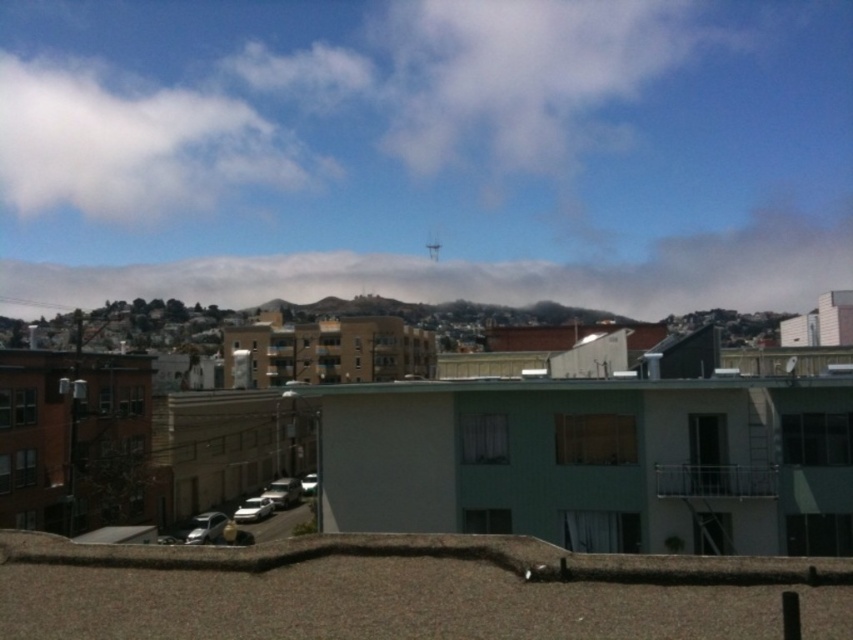
You are a drone operator who needs to fly a drone between the two clouds. The drone has a maximum flight distance of 200 feet. Can the drone safely fly between the white fluffy cloud at upper center and the white fluffy cloud at upper left without exceeding its range?

The distance between the white fluffy cloud at upper center and the white fluffy cloud at upper left is 214.18 feet, which exceeds the drone operator maximum flight distance of 200 feet. Therefore, the drone cannot safely fly between them without exceeding its range.

You are an architect designing a new rooftop garden on the textured rooftop with a low wall. You want to place a large sculpture between the white fluffy cloud at upper center and the white fluffy cloud at upper left. Which cloud should the sculpture be closer to if you want it to appear taller in the garden view?

The white fluffy cloud at upper left is taller than the white fluffy cloud at upper center. To make the sculpture appear taller, place it closer to the white fluffy cloud at upper left since it is taller and will provide a better backdrop for the sculpture.